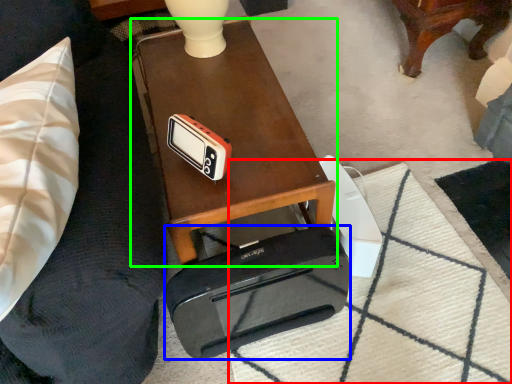
Question: Considering the real-world distances, which object is farthest from mat (highlighted by a red box)? cassette (highlighted by a blue box) or table (highlighted by a green box)?

Choices:
 (A) cassette
 (B) table

Answer: (B)